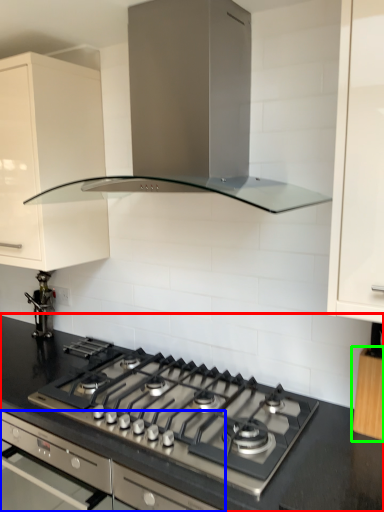
Question: Considering the real-world distances, which object is farthest from countertop (highlighted by a red box)? oven (highlighted by a blue box) or cabinetry (highlighted by a green box)?

Choices:
 (A) oven
 (B) cabinetry

Answer: (B)